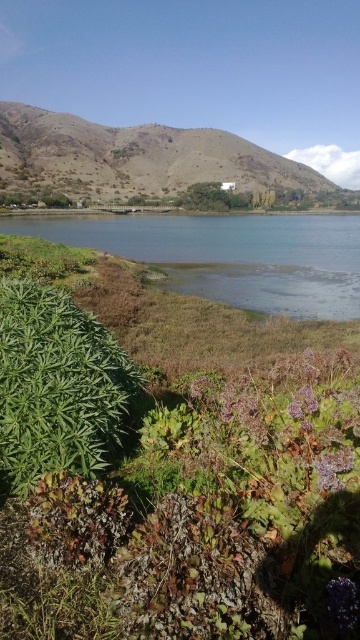
Question: Does clear water at lower left come in front of purple matte flower at lower right?

Choices:
 (A) no
 (B) yes

Answer: (A)

Question: Considering the relative positions of green leafy plant at lower left and purple matte flower at lower right in the image provided, where is green leafy plant at lower left located with respect to purple matte flower at lower right?

Choices:
 (A) above
 (B) below

Answer: (A)

Question: Which point is closer to the camera?

Choices:
 (A) purple fuzzy flower at lower center
 (B) clear water at lower left
 (C) green leafy plant at lower left
 (D) brown/dry grassy hillside at upper center

Answer: (A)

Question: Which object is positioned farthest from the clear water at lower left?

Choices:
 (A) green leafy plant at lower left
 (B) purple fuzzy flower at lower center
 (C) purple matte flower at lower right
 (D) brown/dry grassy hillside at upper center

Answer: (B)

Question: Which point is closer to the camera taking this photo?

Choices:
 (A) (18, 385)
 (B) (15, 147)
 (C) (344, 236)
 (D) (298, 396)

Answer: (D)

Question: Is the position of clear water at lower left less distant than that of purple matte flower at lower right?

Choices:
 (A) no
 (B) yes

Answer: (A)